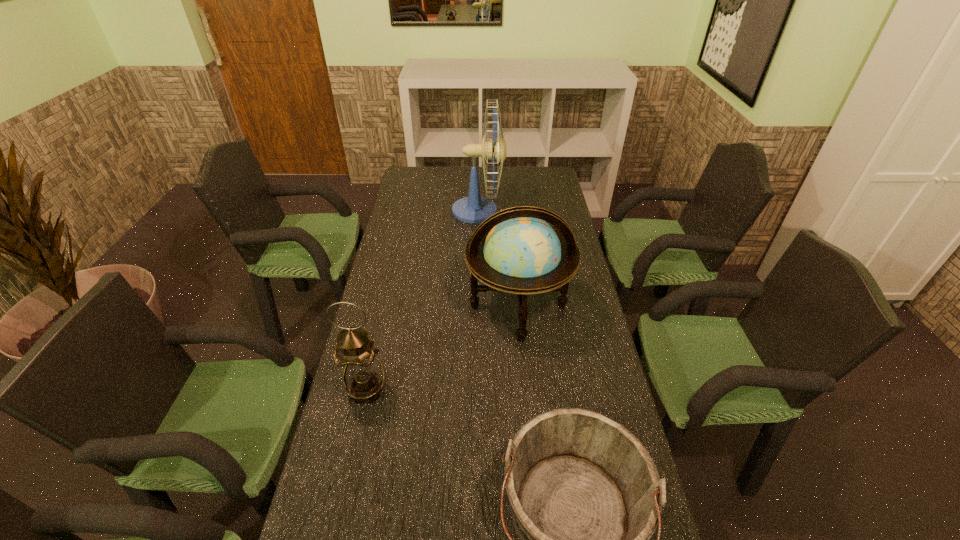
I want to click on fan, so click(473, 209).

Find the location of a particular element. the tallest object is located at coordinates (473, 209).

Where is `globe`? globe is located at coordinates 515,251.

You are a GUI agent. You are given a task and a screenshot of the screen. Output one action in this format:
    pyautogui.click(x=<x>, y=<y>)
    Task: Click on the oil lamp
    This screenshot has height=540, width=960.
    Given the screenshot: What is the action you would take?
    pyautogui.click(x=363, y=375)

The width and height of the screenshot is (960, 540). Identify the location of the third farthest object. (363, 375).

Where is `vacant area situated at the front of the farthest object where the blades are visible`? The height and width of the screenshot is (540, 960). vacant area situated at the front of the farthest object where the blades are visible is located at coordinates (517, 211).

I want to click on vacant space positioned 0.050m on the surface of the globe, so click(x=523, y=359).

Where is `vacant space located 0.220m on the front of the second nearest object`? This screenshot has height=540, width=960. vacant space located 0.220m on the front of the second nearest object is located at coordinates (344, 492).

You are a GUI agent. You are given a task and a screenshot of the screen. Output one action in this format:
    pyautogui.click(x=<x>, y=<y>)
    Task: Click on the object that is at the far edge
    The width and height of the screenshot is (960, 540).
    Given the screenshot: What is the action you would take?
    pyautogui.click(x=473, y=209)

What are the coordinates of `object that is at the left edge` in the screenshot? It's located at (363, 375).